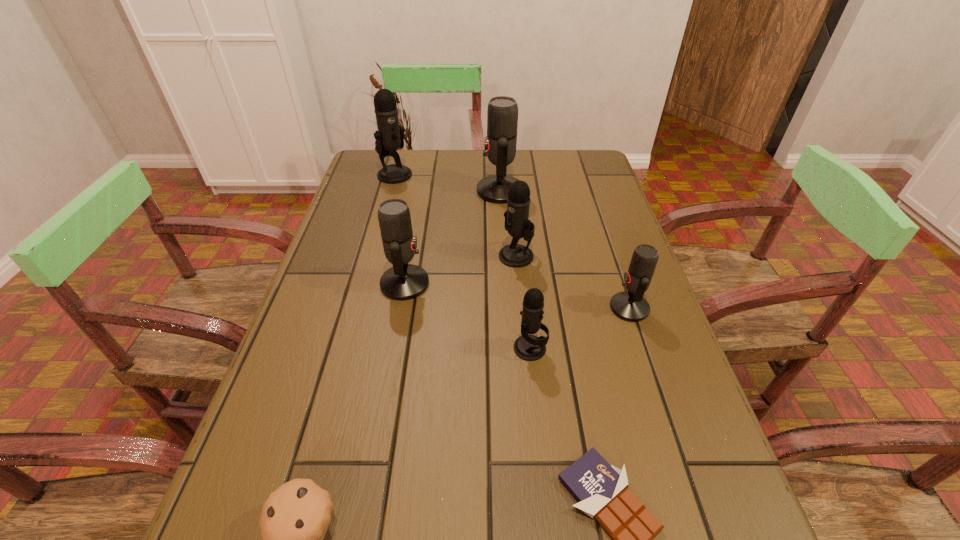
The image size is (960, 540). I want to click on black microphone that can be found as the third closest to the shortest object, so click(x=389, y=137).

What are the coordinates of `blank space that satisfies the following two spatial constraints: 1. on the side of the second smallest red microphone with the red ring; 2. on the right side of the third nearest object` in the screenshot? It's located at (394, 348).

Where is `blank space that satisfies the following two spatial constraints: 1. on the side of the leftmost red microphone with the red ring; 2. on the left side of the sixth farthest object`? blank space that satisfies the following two spatial constraints: 1. on the side of the leftmost red microphone with the red ring; 2. on the left side of the sixth farthest object is located at coordinates (394, 348).